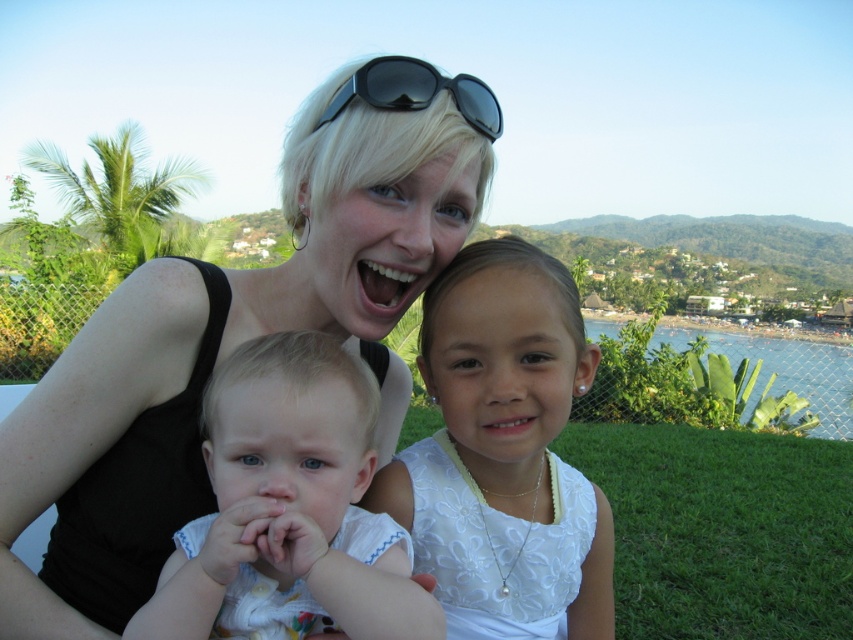
Can you confirm if matte black tank top at center is taller than black plastic sunglasses at upper center?

Yes.

From the picture: Who is taller, matte black tank top at center or black plastic sunglasses at upper center?

With more height is matte black tank top at center.

Between point (198, 442) and point (392, 58), which one is positioned behind?

The point (198, 442) is behind.

The image size is (853, 640). Find the location of `matte black tank top at center`. matte black tank top at center is located at coordinates (223, 353).

Is point (312, 356) behind point (573, 445)?

No, it is in front of (573, 445).

Between point (267, 488) and point (775, 570), which one is positioned in front?

Point (267, 488) is more forward.

The width and height of the screenshot is (853, 640). In order to click on light blue fabric baby at center in this screenshot , I will do `click(288, 509)`.

Is matte black tank top at center below light blue fabric baby at center?

Incorrect, matte black tank top at center is not positioned below light blue fabric baby at center.

Is matte black tank top at center further to the viewer compared to light blue fabric baby at center?

That is True.

This screenshot has width=853, height=640. Find the location of `matte black tank top at center`. matte black tank top at center is located at coordinates (223, 353).